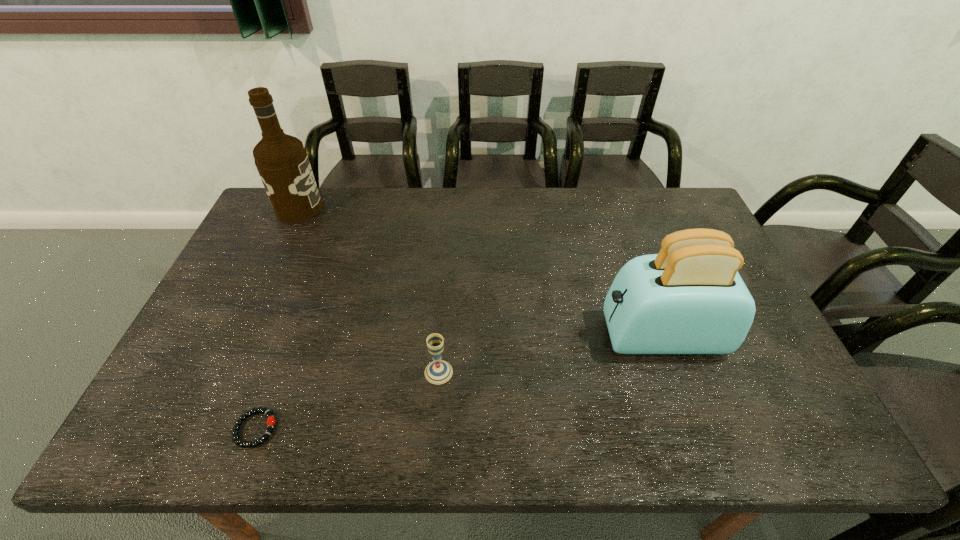
I want to click on vacant space located on the side of the third shortest object with the lever, so click(x=563, y=336).

Locate an element on the screen. Image resolution: width=960 pixels, height=540 pixels. free location located on the side of the third shortest object with the lever is located at coordinates (559, 336).

Find the location of a particular element. vacant space located on the left of the chalice is located at coordinates (299, 372).

This screenshot has height=540, width=960. In order to click on vacant area situated 0.100m on the back of the bracelet in this screenshot , I will do `click(276, 372)`.

Locate an element on the screen. The image size is (960, 540). object that is at the far edge is located at coordinates (282, 162).

This screenshot has width=960, height=540. Identify the location of object that is at the near edge. (270, 422).

The height and width of the screenshot is (540, 960). I want to click on object that is at the left edge, so click(x=282, y=162).

Locate an element on the screen. Image resolution: width=960 pixels, height=540 pixels. object that is positioned at the right edge is located at coordinates [689, 298].

Locate an element on the screen. The width and height of the screenshot is (960, 540). object at the far left corner is located at coordinates (282, 162).

Identify the location of vacant space at the far edge of the desktop. (442, 221).